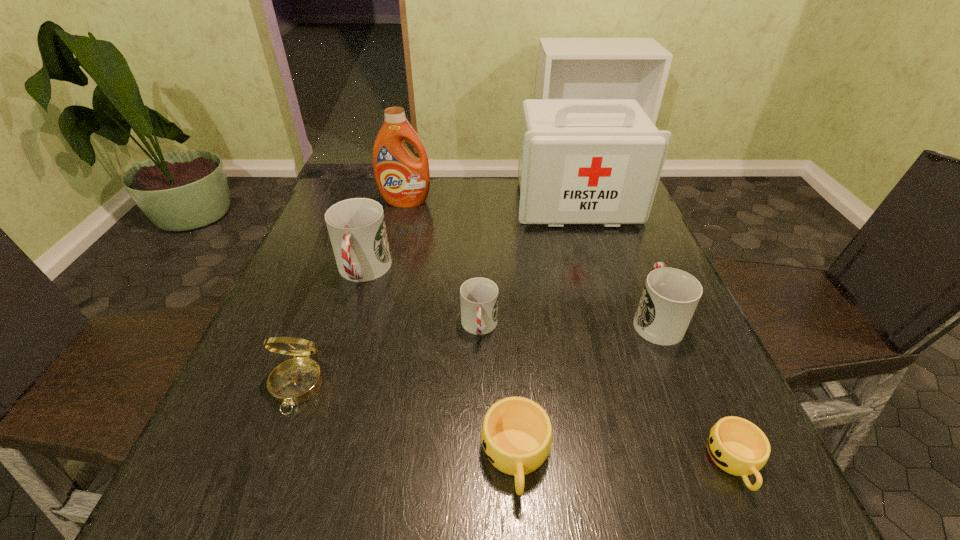
I want to click on free space located on the side of the smallest red cup where the handle is located, so click(x=479, y=500).

I want to click on free spot located 0.100m on the left of the seventh tallest object, so click(418, 457).

The image size is (960, 540). I want to click on free point located on the back of the right beige cup, so click(x=690, y=363).

In order to click on the first-aid kit located in the far edge section of the desktop in this screenshot , I will do `click(581, 161)`.

This screenshot has height=540, width=960. I want to click on detergent located in the far edge section of the desktop, so click(403, 180).

Locate an element on the screen. detergent located at the left edge is located at coordinates (403, 180).

You are a GUI agent. You are given a task and a screenshot of the screen. Output one action in this format:
    pyautogui.click(x=<x>, y=<y>)
    Task: Click on the cup at the left edge
    Image resolution: width=960 pixels, height=540 pixels.
    Given the screenshot: What is the action you would take?
    pyautogui.click(x=356, y=227)

At what (x,y) coordinates should I click in order to perform the action: click on compass that is at the left edge. Please return your answer as a coordinate pair (x, y). The image size is (960, 540). Looking at the image, I should click on (295, 381).

I want to click on the first-aid kit located at the right edge, so click(x=581, y=161).

I want to click on object positioned at the far left corner, so click(x=403, y=180).